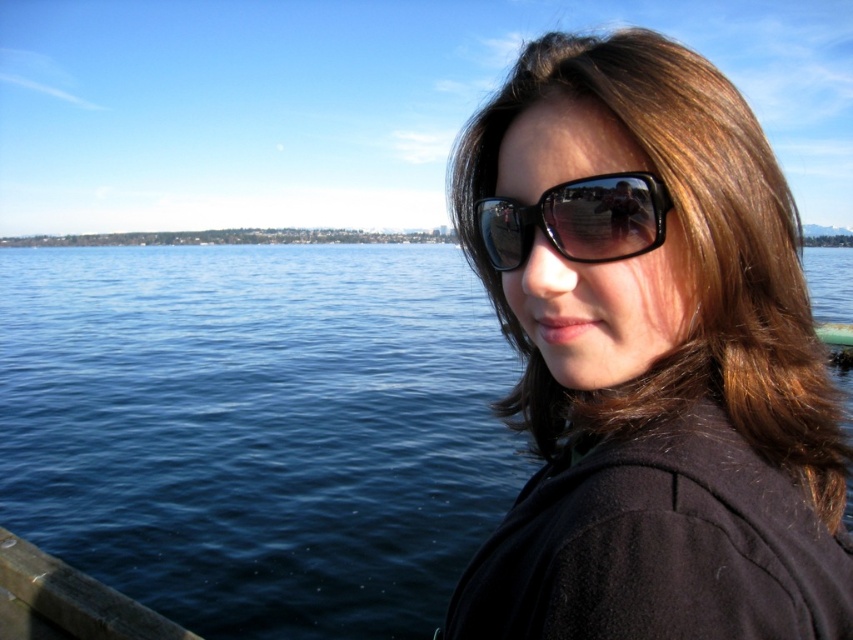
Question: Among these points, which one is nearest to the camera?

Choices:
 (A) (15, 476)
 (B) (686, 163)
 (C) (624, 189)

Answer: (B)

Question: Among these points, which one is nearest to the camera?

Choices:
 (A) (506, 218)
 (B) (643, 193)
 (C) (386, 269)

Answer: (B)

Question: Which point is closer to the camera?

Choices:
 (A) sunglasses at right
 (B) black reflective sunglasses at center

Answer: (A)

Question: Does sunglasses at right have a lesser width compared to black reflective sunglasses at center?

Choices:
 (A) no
 (B) yes

Answer: (A)

Question: Is sunglasses at right to the right of blue water at left from the viewer's perspective?

Choices:
 (A) yes
 (B) no

Answer: (B)

Question: Can you confirm if sunglasses at right is positioned to the left of black reflective sunglasses at center?

Choices:
 (A) yes
 (B) no

Answer: (B)